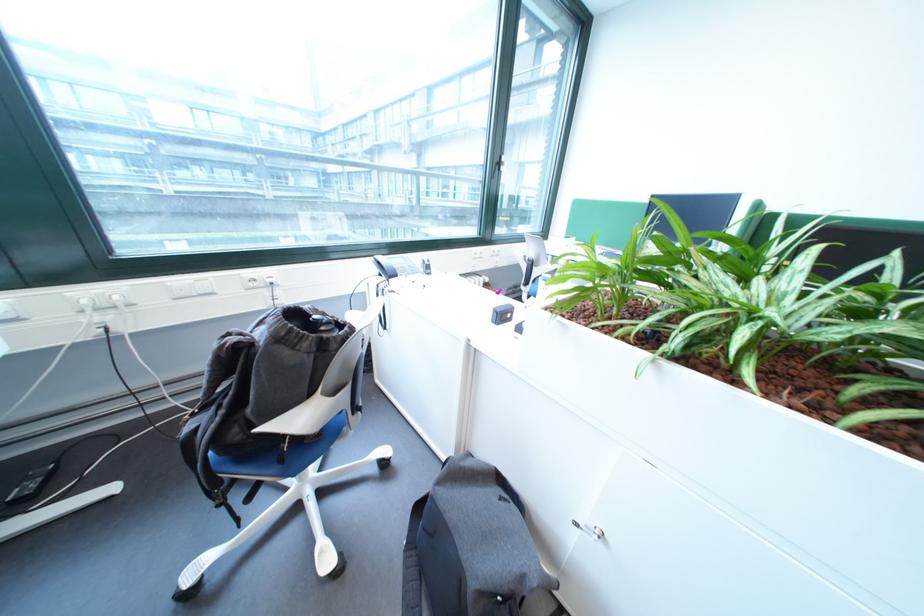
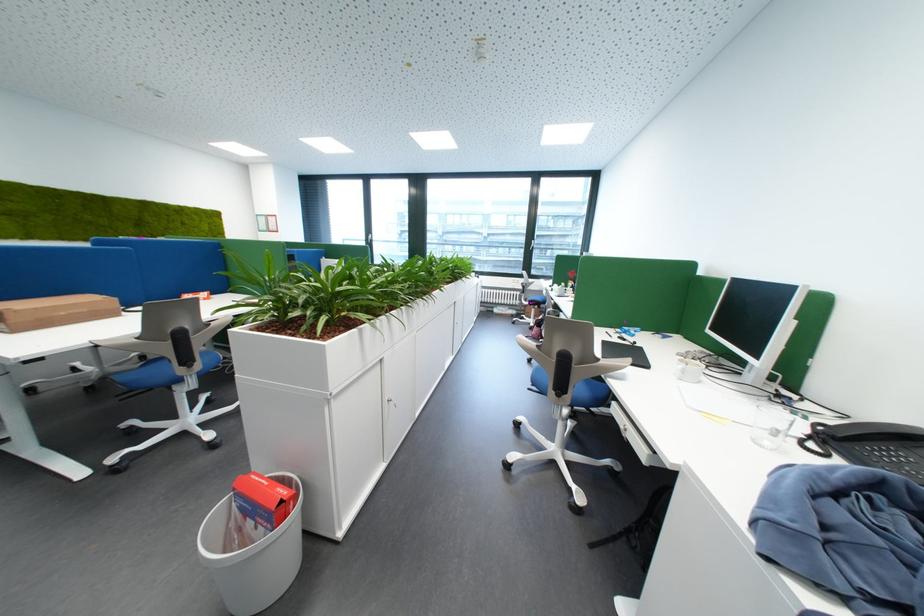
Question: I am providing you with two images of the same scene from different viewpoints. Please identify which objects are invisible in image2.

Choices:
 (A) white basket
 (B) brown cardboard box
 (C) white power switch
 (D) telephone handset

Answer: (C)